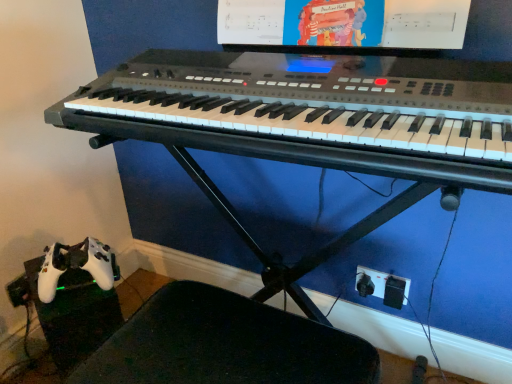
You are a GUI agent. You are given a task and a screenshot of the screen. Output one action in this format:
    pyautogui.click(x=<x>, y=<y>)
    Task: Click on the satin black keyboard at center
    This screenshot has width=512, height=384.
    Given the screenshot: What is the action you would take?
    (312, 112)

Describe the element at coordinates (383, 286) in the screenshot. I see `black plastic plug at lower right` at that location.

The height and width of the screenshot is (384, 512). I want to click on matte plastic computer monitor at upper center, so [343, 23].

Which object is further away from the camera, black plastic plug at lower right or black plastic swivel chair at lower left?

Positioned behind is black plastic plug at lower right.

Is black plastic plug at lower right located outside black plastic swivel chair at lower left?

Indeed, black plastic plug at lower right is completely outside black plastic swivel chair at lower left.

Can you confirm if black plastic plug at lower right is thinner than black plastic swivel chair at lower left?

Indeed, black plastic plug at lower right has a lesser width compared to black plastic swivel chair at lower left.

From the image's perspective, which one is positioned higher, black plastic plug at lower right or black plastic swivel chair at lower left?

black plastic plug at lower right appears higher in the image.

Considering the points (250, 16) and (224, 362), which point is in front, point (250, 16) or point (224, 362)?

Point (224, 362)

Is the position of matte plastic computer monitor at upper center more distant than that of black plastic swivel chair at lower left?

Yes, it is behind black plastic swivel chair at lower left.

From a real-world perspective, is matte plastic computer monitor at upper center located higher than black plastic swivel chair at lower left?

Yes, from a real-world perspective, matte plastic computer monitor at upper center is over black plastic swivel chair at lower left

From the picture: From the image's perspective, between black plastic swivel chair at lower left and matte plastic computer monitor at upper center, who is located below?

From the image's view, black plastic swivel chair at lower left is below.

From a real-world perspective, which is physically above, black plastic swivel chair at lower left or matte plastic computer monitor at upper center?

matte plastic computer monitor at upper center is physically above.

Do you think black plastic swivel chair at lower left is within matte plastic computer monitor at upper center, or outside of it?

black plastic swivel chair at lower left is outside matte plastic computer monitor at upper center.

Between black plastic plug at lower right and matte plastic computer monitor at upper center, which one appears on the right side from the viewer's perspective?

black plastic plug at lower right.

Can you see black plastic plug at lower right touching matte plastic computer monitor at upper center?

No, black plastic plug at lower right is not beside matte plastic computer monitor at upper center.

How much distance is there between black plastic plug at lower right and matte plastic computer monitor at upper center?

black plastic plug at lower right is 26.80 inches away from matte plastic computer monitor at upper center.

Is black plastic plug at lower right turned away from matte plastic computer monitor at upper center?

No, matte plastic computer monitor at upper center is not at the back of black plastic plug at lower right.

Between satin black keyboard at center and black plastic swivel chair at lower left, which one has smaller width?

black plastic swivel chair at lower left is thinner.

From the picture: From a real-world perspective, which is physically above, satin black keyboard at center or black plastic swivel chair at lower left?

satin black keyboard at center, from a real-world perspective.

Is satin black keyboard at center positioned with its back to black plastic swivel chair at lower left?

No, satin black keyboard at center's orientation is not away from black plastic swivel chair at lower left.

Considering the positions of objects black plastic swivel chair at lower left and satin black keyboard at center in the image provided, who is more to the left, black plastic swivel chair at lower left or satin black keyboard at center?

black plastic swivel chair at lower left is more to the left.

From a real-world perspective, who is located higher, black plastic swivel chair at lower left or satin black keyboard at center?

satin black keyboard at center, from a real-world perspective.

Can satin black keyboard at center be found inside black plastic swivel chair at lower left?

No, satin black keyboard at center is not inside black plastic swivel chair at lower left.

Does black plastic swivel chair at lower left have a greater width compared to black plastic plug at lower right?

Yes, black plastic swivel chair at lower left is wider than black plastic plug at lower right.

Which is in front, point (293, 338) or point (407, 279)?

The point (293, 338) is closer.

Is black plastic swivel chair at lower left inside or outside of black plastic plug at lower right?

The correct answer is: outside.

In order to click on plug that is on the right side of black plastic swivel chair at lower left in this screenshot , I will do `click(383, 286)`.

Image resolution: width=512 pixels, height=384 pixels. I want to click on swivel chair below the matte plastic computer monitor at upper center (from a real-world perspective), so click(x=225, y=344).

When comparing their distances from black plastic plug at lower right, does black plastic swivel chair at lower left or satin black keyboard at center seem further?

satin black keyboard at center.

When comparing their distances from black plastic swivel chair at lower left, does matte plastic computer monitor at upper center or black plastic plug at lower right seem closer?

Based on the image, black plastic plug at lower right appears to be nearer to black plastic swivel chair at lower left.

From the image, which object appears to be nearer to matte plastic computer monitor at upper center, black plastic plug at lower right or black plastic swivel chair at lower left?

black plastic swivel chair at lower left is positioned closer to the anchor matte plastic computer monitor at upper center.

When comparing their distances from black plastic swivel chair at lower left, does black plastic plug at lower right or matte plastic computer monitor at upper center seem further?

Among the two, matte plastic computer monitor at upper center is located further to black plastic swivel chair at lower left.

Looking at the image, which one is located further to satin black keyboard at center, black plastic plug at lower right or black plastic swivel chair at lower left?

Among the two, black plastic plug at lower right is located further to satin black keyboard at center.

Based on their spatial positions, is black plastic plug at lower right or matte plastic computer monitor at upper center closer to satin black keyboard at center?

matte plastic computer monitor at upper center is closer to satin black keyboard at center.

Which object lies further to the anchor point matte plastic computer monitor at upper center, satin black keyboard at center or black plastic plug at lower right?

black plastic plug at lower right.

Estimate the real-world distances between objects in this image. Which object is further from black plastic plug at lower right, black plastic swivel chair at lower left or matte plastic computer monitor at upper center?

matte plastic computer monitor at upper center is further to black plastic plug at lower right.

Locate an element on the screen. The width and height of the screenshot is (512, 384). musical keyboard between black plastic swivel chair at lower left and black plastic plug at lower right from front to back is located at coordinates (312, 112).

This screenshot has height=384, width=512. I want to click on computer monitor between black plastic swivel chair at lower left and black plastic plug at lower right along the z-axis, so click(x=343, y=23).

The image size is (512, 384). Identify the location of musical keyboard between matte plastic computer monitor at upper center and black plastic swivel chair at lower left from top to bottom. (312, 112).

This screenshot has height=384, width=512. In order to click on computer monitor positioned between satin black keyboard at center and black plastic plug at lower right from near to far in this screenshot , I will do `click(343, 23)`.